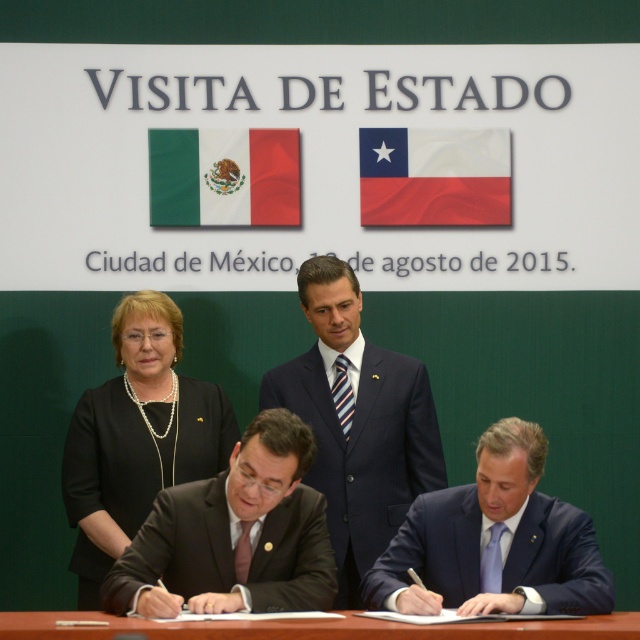
You are attending the state visit event and need to determine which object occupies more space in the image. Based on the scene description, which one is larger between the dark blue pinstripe suit at center and the red fabric chilean flag at center?

The dark blue pinstripe suit at center is bigger than the red fabric chilean flag at center, so the dark blue pinstripe suit at center occupies more space in the image.

You are attending the state visit event and need to determine if the dark blue pinstripe suit at center can be fully visible from the side of the red fabric chilean flag at center. Based on their widths, can you confirm this?

The dark blue pinstripe suit at center might be wider than red fabric chilean flag at center, so there is a possibility that parts of the dark blue pinstripe suit at center could be obscured from the side of the red fabric chilean flag at center depending on their exact positioning.

In the scene shown: You are attending the state visit event and notice two items of interest. One is the dark gray suit at center and the other is the green fabric flag at upper center. Based on their positions, which item is positioned higher up in the image?

The green fabric flag at upper center is positioned higher up in the image than the dark gray suit at center, as it is located above it.